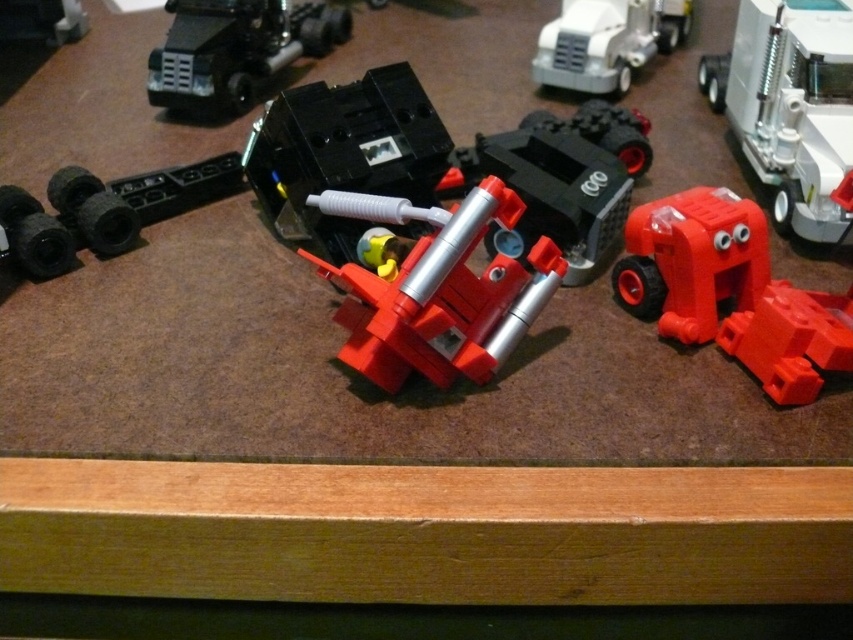
You are a child trying to build a tower with the matte plastic robot at center and the black plastic car at center. Which object should you place at the bottom to ensure stability?

The matte plastic robot at center should be placed at the bottom because it is located below the black plastic car at center in the image, indicating it has a larger base for stability.

You are a photographer standing at the camera position. You want to focus on the point that is closer to you. Which point should you choose between point (263, 156) and point (151, 83)?

Point (263, 156) is closer to the camera than point (151, 83), so you should choose point (263, 156) to focus on.

You are a child trying to reach the black plastic car at center from where you are standing. Is the matte plastic robot at center blocking your path to the car?

The matte plastic robot at center is in front of the black plastic car at center, so it is blocking the path to the car.